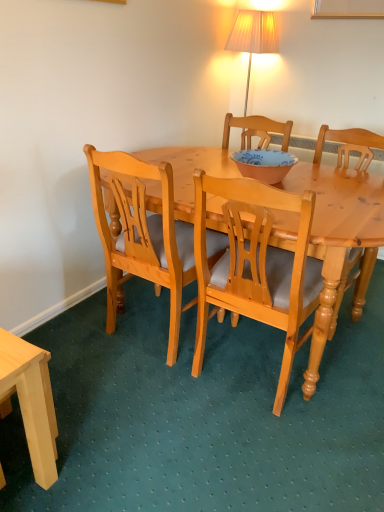
Identify the location of free space to the left of light brown wood chair at center, acting as the third chair starting from the right. This screenshot has width=384, height=512. (86, 333).